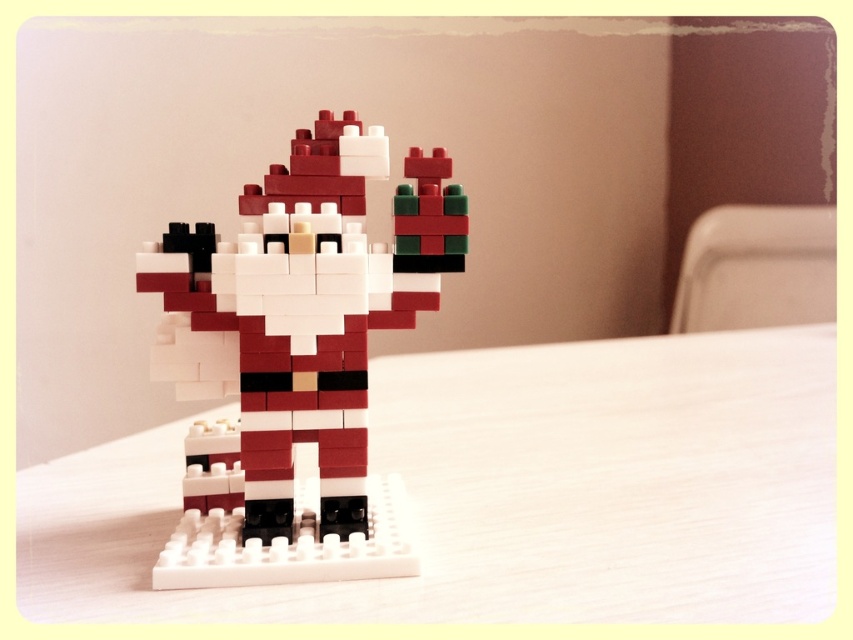
Who is taller, white matte table at center or matte plastic santa at center?

With more height is matte plastic santa at center.

Is white matte table at center positioned in front of matte plastic santa at center?

Yes, white matte table at center is in front of matte plastic santa at center.

Find the location of a particular element. This screenshot has height=640, width=853. white matte table at center is located at coordinates (514, 493).